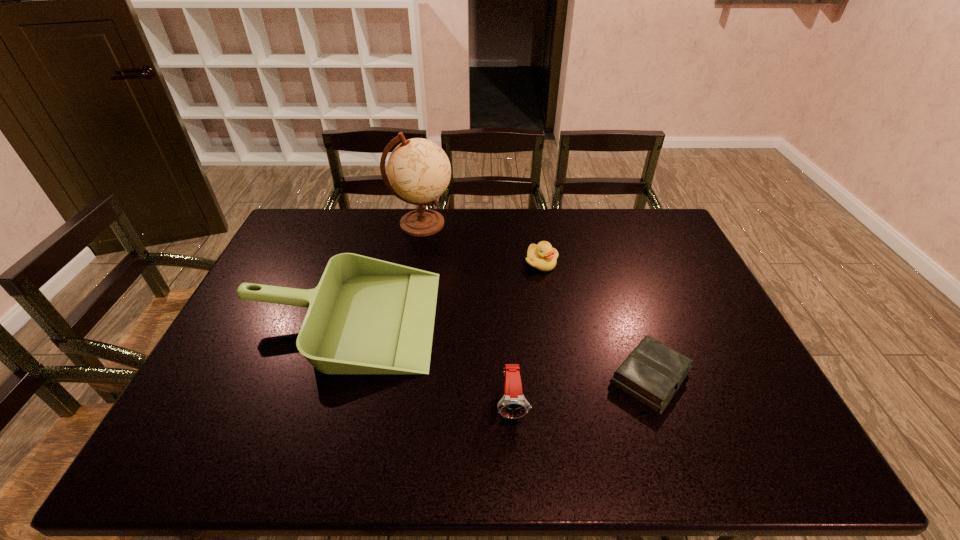
Image resolution: width=960 pixels, height=540 pixels. What are the coordinates of `vacant region between the watch and the second object from right to left` in the screenshot? It's located at (527, 333).

Where is `vacant space in between the tallest object and the watch`? This screenshot has width=960, height=540. vacant space in between the tallest object and the watch is located at coordinates (467, 314).

Identify the location of free area in between the fourth object from left to right and the farthest object. (481, 243).

Find the location of a particular element. This screenshot has height=540, width=960. free space between the tallest object and the second shortest object is located at coordinates (481, 243).

You are a GUI agent. You are given a task and a screenshot of the screen. Output one action in this format:
    pyautogui.click(x=<x>, y=<y>)
    Task: Click on the empty location between the third object from left to right and the tallest object
    
    Given the screenshot: What is the action you would take?
    pyautogui.click(x=467, y=314)

Identify the location of free space between the shortest object and the watch. Image resolution: width=960 pixels, height=540 pixels. (581, 390).

I want to click on empty location between the book and the globe, so click(x=536, y=300).

Identify the location of object identified as the third closest to the fourth tallest object. (652, 373).

Locate an element on the screen. The height and width of the screenshot is (540, 960). object that is the second closest to the fourth tallest object is located at coordinates (366, 316).

I want to click on free space that satisfies the following two spatial constraints: 1. on the scoop of the shortest object; 2. on the right side of the dustpan, so click(x=324, y=377).